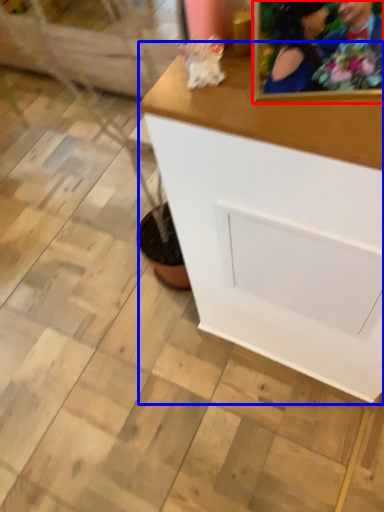
Question: Among these objects, which one is nearest to the camera, picture frame (highlighted by a red box) or table (highlighted by a blue box)?

Choices:
 (A) picture frame
 (B) table

Answer: (A)